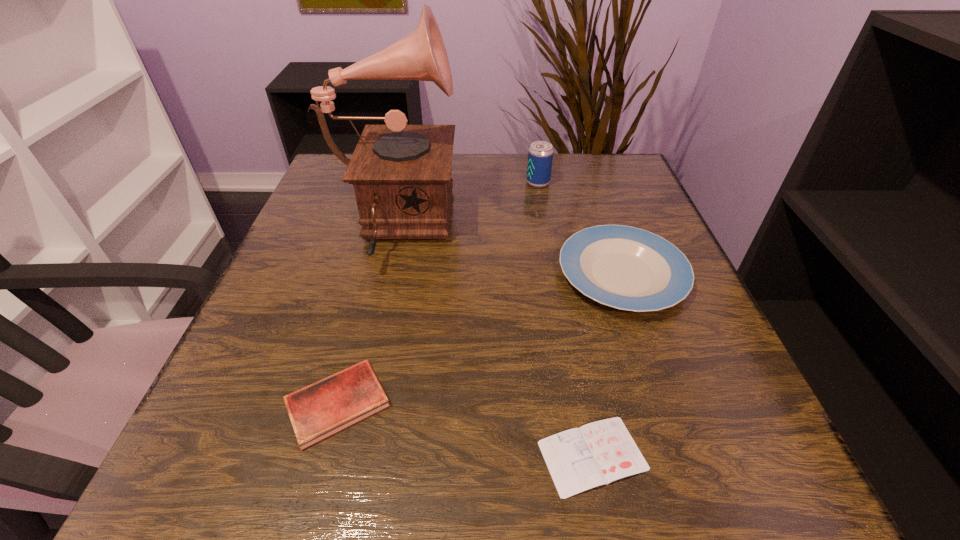
This screenshot has width=960, height=540. Identify the location of free area in between the record player and the shorter diary. (492, 341).

The image size is (960, 540). I want to click on vacant space in between the shortest object and the record player, so click(492, 341).

Identify the location of unoccupied area between the tallest object and the right diary. The width and height of the screenshot is (960, 540). (492, 341).

Identify the location of free space between the plate and the second shortest object. (480, 339).

This screenshot has width=960, height=540. I want to click on vacant point located between the record player and the shorter diary, so click(492, 341).

Locate which object is the closest to the fourth shortest object. Please provide its 2D coordinates. Your answer should be formatted as a tuple, i.e. [(x, y)], where the tuple contains the x and y coordinates of a point satisfying the conditions above.

[(401, 174)]

Where is `object that is the closest to the fourth tallest object`? This screenshot has width=960, height=540. object that is the closest to the fourth tallest object is located at coordinates (401, 174).

Image resolution: width=960 pixels, height=540 pixels. What are the coordinates of `free space that satisfies the following two spatial constraints: 1. on the back side of the left diary; 2. on the left side of the third shortest object` in the screenshot? It's located at click(372, 275).

You are a GUI agent. You are given a task and a screenshot of the screen. Output one action in this format:
    pyautogui.click(x=<x>, y=<y>)
    Task: Click on the vacant area that satisfies the following two spatial constraints: 1. on the horn of the plate; 2. on the right side of the tallest object
    This screenshot has height=540, width=960.
    Given the screenshot: What is the action you would take?
    pyautogui.click(x=380, y=275)

The height and width of the screenshot is (540, 960). I want to click on blank area in the image that satisfies the following two spatial constraints: 1. on the horn of the shortest object; 2. on the left side of the record player, so click(337, 456).